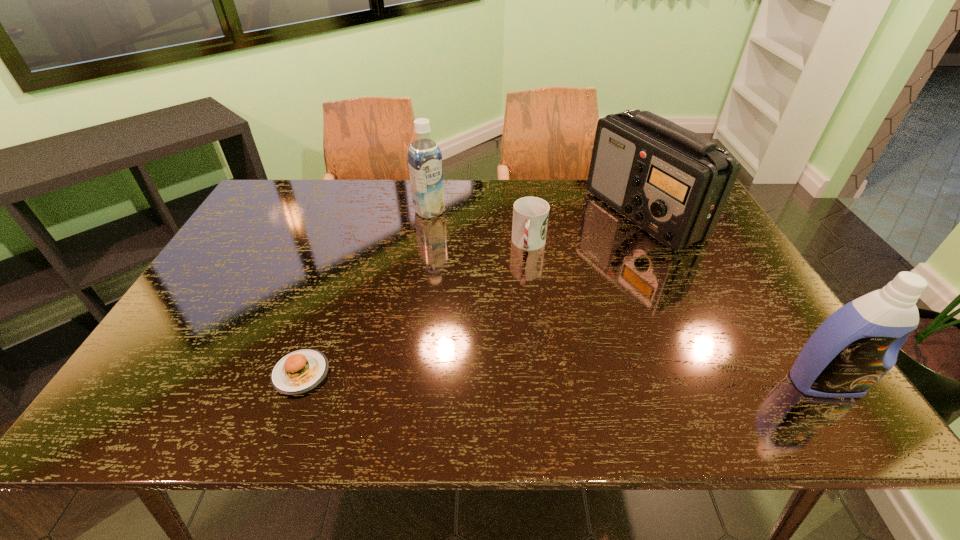
This screenshot has height=540, width=960. Identify the location of vacant space on the desktop that is between the shortest object and the detergent and is positioned on the handle side of the third object from left to right. (499, 377).

The image size is (960, 540). Find the location of `free spot on the desktop that is between the leftmost object and the detergent and is positioned on the front panel of the radio receiver`. free spot on the desktop that is between the leftmost object and the detergent and is positioned on the front panel of the radio receiver is located at coordinates (540, 377).

Locate an element on the screen. Image resolution: width=960 pixels, height=540 pixels. vacant spot on the desktop that is between the leftmost object and the detergent and is positioned on the label of the soya milk is located at coordinates (586, 379).